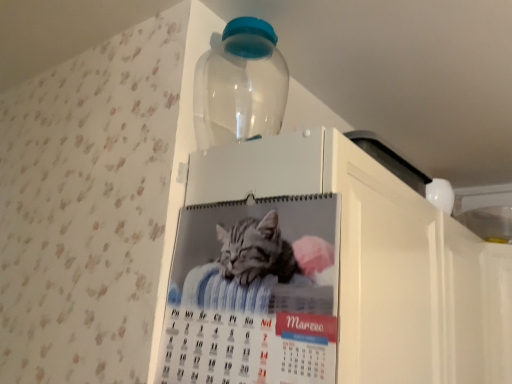
Question: Does printed paper calendar at center appear on the left side of white glossy calendar at upper center?

Choices:
 (A) no
 (B) yes

Answer: (B)

Question: Does printed paper calendar at center have a smaller size compared to white glossy calendar at upper center?

Choices:
 (A) no
 (B) yes

Answer: (B)

Question: Is printed paper calendar at center facing away from white glossy calendar at upper center?

Choices:
 (A) yes
 (B) no

Answer: (A)

Question: Considering the relative sizes of printed paper calendar at center and white glossy calendar at upper center in the image provided, is printed paper calendar at center wider than white glossy calendar at upper center?

Choices:
 (A) yes
 (B) no

Answer: (B)

Question: Is printed paper calendar at center aimed at white glossy calendar at upper center?

Choices:
 (A) no
 (B) yes

Answer: (A)

Question: From a real-world perspective, is printed paper calendar at center under white glossy calendar at upper center?

Choices:
 (A) yes
 (B) no

Answer: (B)

Question: Is transparent plastic bottle at upper center outside of white glossy calendar at upper center?

Choices:
 (A) yes
 (B) no

Answer: (A)

Question: From a real-world perspective, is transparent plastic bottle at upper center on top of white glossy calendar at upper center?

Choices:
 (A) no
 (B) yes

Answer: (B)

Question: Can you confirm if transparent plastic bottle at upper center is bigger than white glossy calendar at upper center?

Choices:
 (A) yes
 (B) no

Answer: (B)

Question: Is transparent plastic bottle at upper center positioned behind white glossy calendar at upper center?

Choices:
 (A) no
 (B) yes

Answer: (B)

Question: Is transparent plastic bottle at upper center oriented towards white glossy calendar at upper center?

Choices:
 (A) no
 (B) yes

Answer: (A)

Question: Is transparent plastic bottle at upper center looking in the opposite direction of white glossy calendar at upper center?

Choices:
 (A) yes
 (B) no

Answer: (B)

Question: Can we say white glossy calendar at upper center lies outside printed paper calendar at center?

Choices:
 (A) yes
 (B) no

Answer: (A)